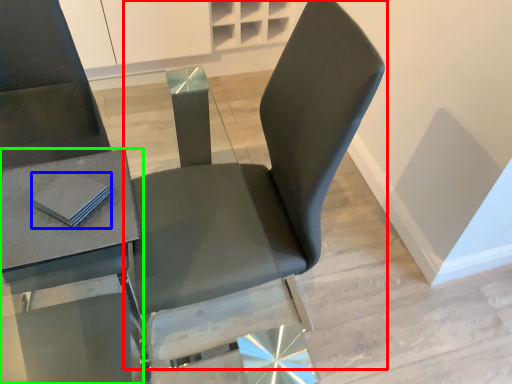
Question: Considering the real-world distances, which object is farthest from chair (highlighted by a red box)? pad (highlighted by a blue box) or table (highlighted by a green box)?

Choices:
 (A) pad
 (B) table

Answer: (A)